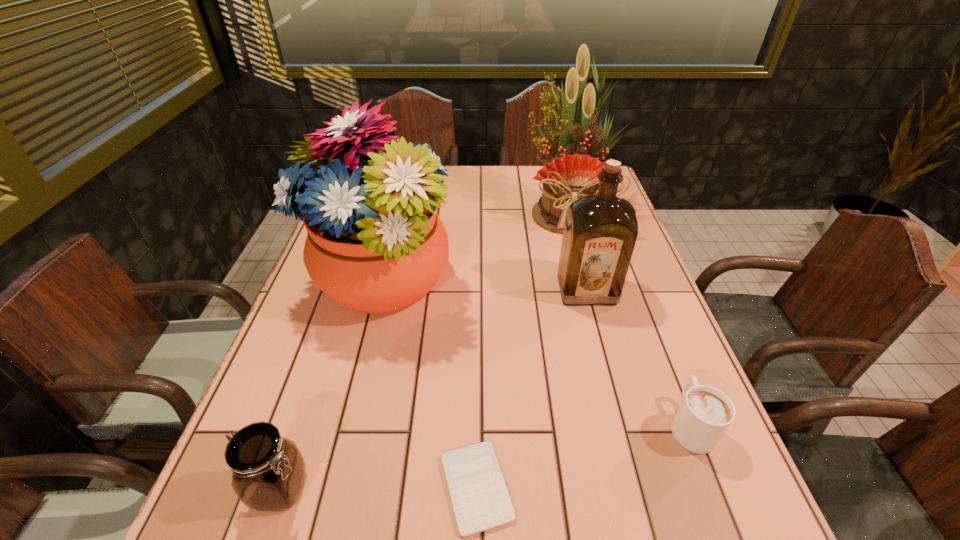
Locate an element on the screen. The height and width of the screenshot is (540, 960). cappuccino that is at the right edge is located at coordinates (705, 414).

Identify the location of object at the far right corner. (572, 173).

Image resolution: width=960 pixels, height=540 pixels. In the image, there is a desktop. Find the location of `free region at the far edge`. free region at the far edge is located at coordinates (514, 179).

In the image, there is a desktop. Identify the location of free region at the left edge. (303, 444).

In the image, there is a desktop. Where is `free space at the right edge`? free space at the right edge is located at coordinates (666, 492).

Where is `free point between the left flower arrangement and the jar`? The image size is (960, 540). free point between the left flower arrangement and the jar is located at coordinates (331, 384).

At what (x,y) coordinates should I click in order to perform the action: click on unoccupied area between the left flower arrangement and the calculator. Please return your answer as a coordinate pair (x, y). The height and width of the screenshot is (540, 960). Looking at the image, I should click on (429, 384).

You are a GUI agent. You are given a task and a screenshot of the screen. Output one action in this format:
    pyautogui.click(x=<x>, y=<y>)
    Task: Click on the empty space between the cappuccino and the calculator
    The width and height of the screenshot is (960, 540).
    Given the screenshot: What is the action you would take?
    pyautogui.click(x=584, y=456)

Locate an element on the screen. vacant area between the jar and the liquor is located at coordinates (434, 389).

Where is `free space between the liquor and the cappuccino`? free space between the liquor and the cappuccino is located at coordinates (638, 357).